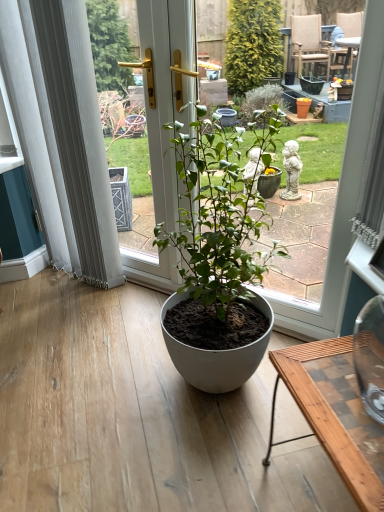
Where is `free region on the left part of white sheer curtain at left`? Image resolution: width=384 pixels, height=512 pixels. free region on the left part of white sheer curtain at left is located at coordinates (40, 295).